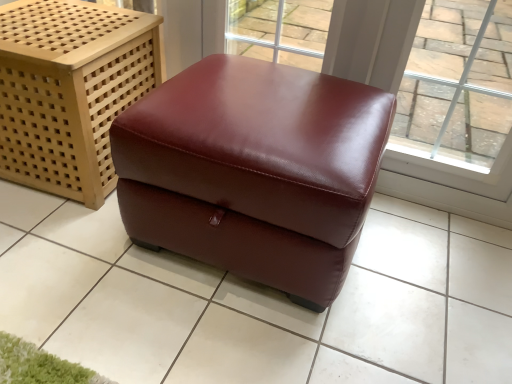
Question: Choose the correct answer: Is transparent glass window at upper right inside burgundy leather ottoman at center or outside it?

Choices:
 (A) outside
 (B) inside

Answer: (A)

Question: Looking at their shapes, would you say transparent glass window at upper right is wider or thinner than burgundy leather ottoman at center?

Choices:
 (A) wide
 (B) thin

Answer: (B)

Question: Which of these objects is positioned farthest from the burgundy leather ottoman at center, marked as the first furniture in a left-to-right arrangement?

Choices:
 (A) transparent glass window at upper right
 (B) burgundy leather ottoman at center, the 2th furniture from the left
 (C) burgundy leather ottoman at center

Answer: (A)

Question: Which object is the farthest from the burgundy leather ottoman at center?

Choices:
 (A) burgundy leather ottoman at center, the 1th furniture from the right
 (B) transparent glass window at upper right
 (C) burgundy leather ottoman at center, marked as the first furniture in a left-to-right arrangement

Answer: (B)